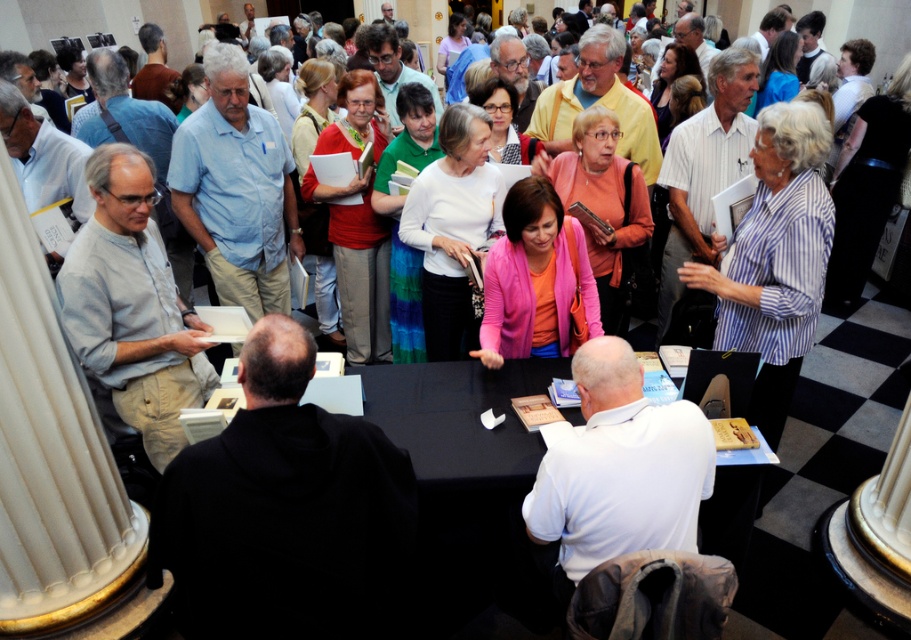
You are organizing a small event and need to place a name tag on either the black hoodie at center or the black fabric table at center. Which object would you choose if you want the name tag to be more noticeable?

The black fabric table at center is larger than the black hoodie at center, so placing the name tag on the black fabric table at center would make it more noticeable.

You are standing in the center of the image and want to move towards the black hoodie at center. Which direction should you move in terms of the image coordinates?

The black hoodie at center is located at point 0.802 on the x axis and 0.315 on the y axis. To move towards it from the center of the image, you should move towards the right and slightly downward since the x coordinate is greater than 0.5 and the y coordinate is less than 0.5.